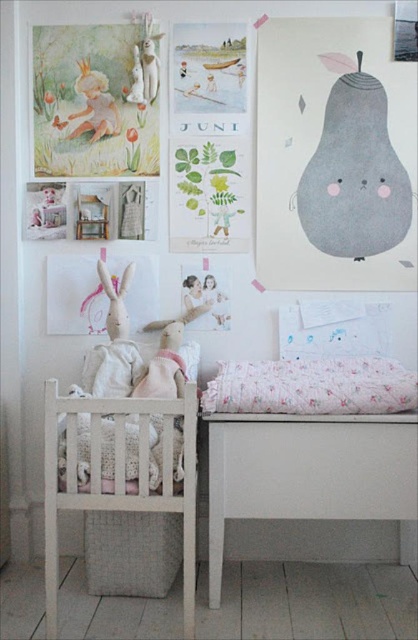
You are a parent looking for a place to put your baby. You see the fluffy white pillow at lower center and the matte white bunny at upper left. Which object is on the right side of the other?

The fluffy white pillow at lower center is positioned on the right side of matte white bunny at upper left.

You are a parent looking to place a new stuffed animal on the white wooden changing table with a soft pink and white patterned blanket. The stuffed animal is 15 cm tall. The fluffy white pillow at lower center is represented by point (x=311, y=387). Can you confirm if there is enough vertical space on the white wooden changing table with a soft pink and white patterned blanket to accommodate the stuffed animal?

The fluffy white pillow at lower center is represented by point (x=311, y=387). The vertical space on the white wooden changing table with a soft pink and white patterned blanket may be sufficient, but the exact height requirement of the pillow isn

You are a parent trying to place a new mobile above the white fabric infant bed at lower right. You also see the fluffy white pillow at lower center. Which object should you position the mobile above to ensure it is correctly placed?

You should position the mobile above the white fabric infant bed at lower right because it is located below the fluffy white pillow at lower center, meaning the pillow is above the bed.